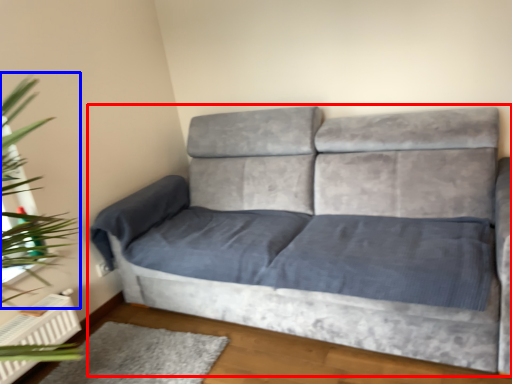
Question: Which point is further to the camera, studio couch (highlighted by a red box) or plant (highlighted by a blue box)?

Choices:
 (A) studio couch
 (B) plant

Answer: (B)